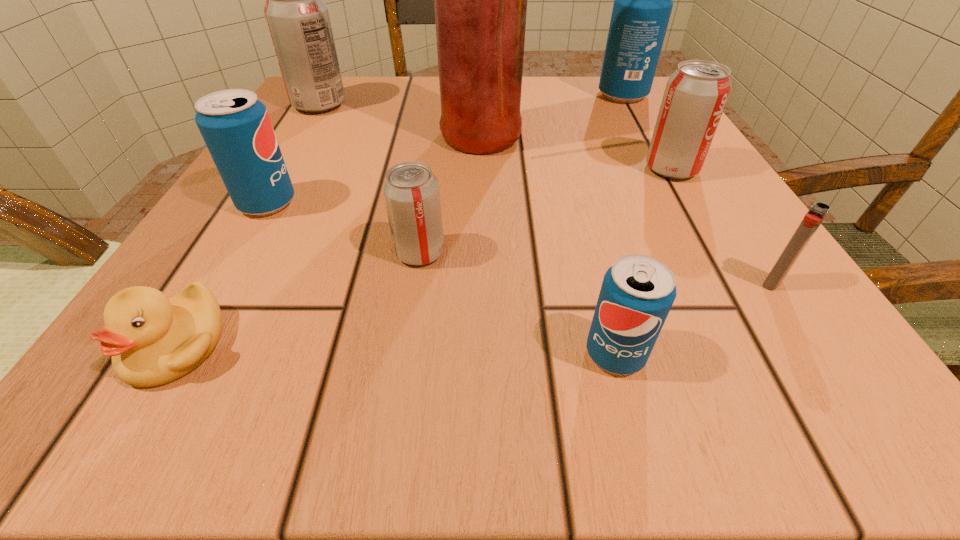
Locate an element on the screen. free space between the leftmost blue soda can and the igniter is located at coordinates (519, 243).

This screenshot has height=540, width=960. Identify the location of free space between the biggest gray soda can and the duckling. (249, 225).

This screenshot has height=540, width=960. In order to click on vacant area that lies between the third nearest object and the yellow duckling in this screenshot , I will do `click(474, 314)`.

You are a GUI agent. You are given a task and a screenshot of the screen. Output one action in this format:
    pyautogui.click(x=<x>, y=<y>)
    Task: Click on the free spot between the red fire extinguisher and the nearest soda can
    This screenshot has width=960, height=540.
    Given the screenshot: What is the action you would take?
    pyautogui.click(x=545, y=247)

You are a GUI agent. You are given a task and a screenshot of the screen. Output one action in this format:
    pyautogui.click(x=<x>, y=<y>)
    Task: Click on the vacant space that is in between the tallest object and the second farthest gray soda can
    Image resolution: width=960 pixels, height=540 pixels.
    Given the screenshot: What is the action you would take?
    [x=573, y=154]

The image size is (960, 540). I want to click on empty space that is in between the duckling and the third nearest soda can, so click(x=222, y=274).

Find the location of a particular element. free space between the yellow duckling and the igniter is located at coordinates (474, 314).

You are a GUI agent. You are given a task and a screenshot of the screen. Output one action in this format:
    pyautogui.click(x=<x>, y=<y>)
    Task: Click on the free space between the fourth soda can from left to right and the nearest gray soda can
    Image resolution: width=960 pixels, height=540 pixels.
    Given the screenshot: What is the action you would take?
    pyautogui.click(x=517, y=303)

The width and height of the screenshot is (960, 540). What are the coordinates of `vacant region between the leftmost gray soda can and the duckling` in the screenshot? It's located at (249, 225).

Locate which object is the third closest to the third soda can from right to left. Please provide its 2D coordinates. Your answer should be formatted as a tuple, i.e. [(x, y)], where the tuple contains the x and y coordinates of a point satisfying the conditions above.

[(695, 96)]